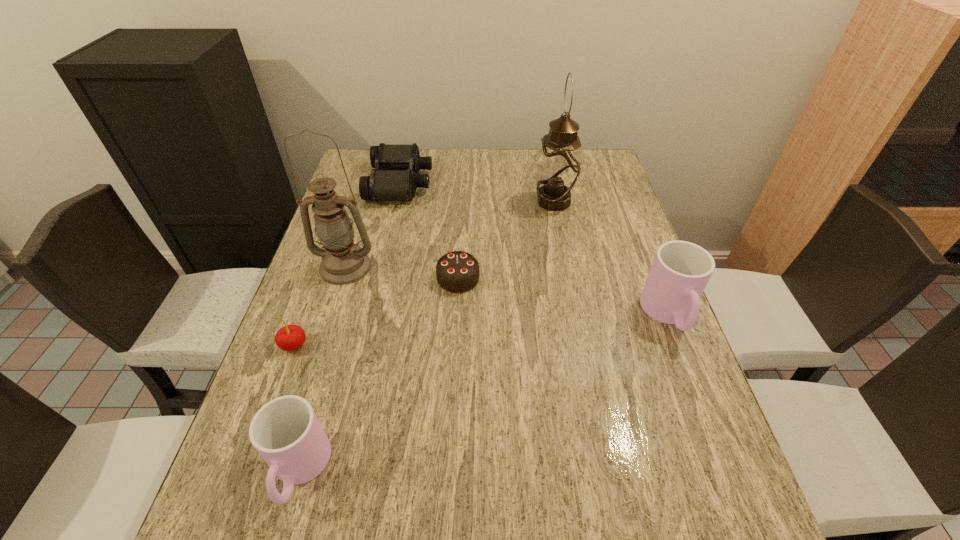
Identify the location of the nearer cup. The height and width of the screenshot is (540, 960). (286, 432).

Locate an element on the screen. The height and width of the screenshot is (540, 960). the shorter cup is located at coordinates (286, 432).

The height and width of the screenshot is (540, 960). I want to click on the farther cup, so click(x=680, y=271).

Where is `the rightmost object`? This screenshot has height=540, width=960. the rightmost object is located at coordinates (680, 271).

You are a GUI agent. You are given a task and a screenshot of the screen. Output one action in this format:
    pyautogui.click(x=<x>, y=<y>)
    Task: Click on the farther oil lamp
    
    Given the screenshot: What is the action you would take?
    pyautogui.click(x=559, y=168)

Image resolution: width=960 pixels, height=540 pixels. I want to click on the right oil lamp, so click(x=559, y=168).

At what (x,y) coordinates should I click in order to perform the action: click on the fifth object from left to right. Please return your answer as a coordinate pair (x, y). Looking at the image, I should click on (458, 271).

Locate an element on the screen. binoculars is located at coordinates (394, 178).

At what (x,y) coordinates should I click in order to perform the action: click on cherry. Please return your answer as a coordinate pair (x, y). Looking at the image, I should click on (291, 337).

At what (x,y) coordinates should I click in order to perform the action: click on the nearer oil lamp. Please return your answer as a coordinate pair (x, y). Looking at the image, I should click on (343, 262).